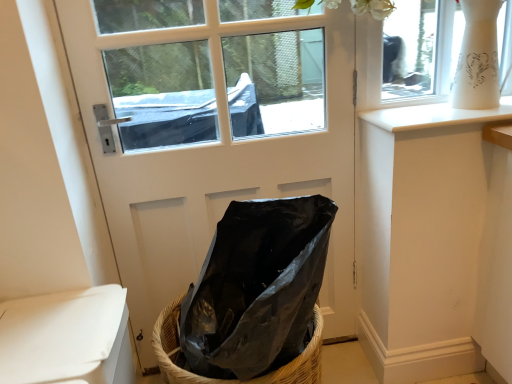
Question: From the image's perspective, is white glossy window sill at upper right beneath black plastic bag at center?

Choices:
 (A) yes
 (B) no

Answer: (B)

Question: Considering the relative positions of white glossy window sill at upper right and black plastic bag at center in the image provided, is white glossy window sill at upper right to the left of black plastic bag at center from the viewer's perspective?

Choices:
 (A) no
 (B) yes

Answer: (A)

Question: Can you confirm if white glossy window sill at upper right is smaller than black plastic bag at center?

Choices:
 (A) yes
 (B) no

Answer: (A)

Question: Can you confirm if white glossy window sill at upper right is positioned to the right of black plastic bag at center?

Choices:
 (A) yes
 (B) no

Answer: (A)

Question: Is white glossy window sill at upper right oriented away from black plastic bag at center?

Choices:
 (A) yes
 (B) no

Answer: (B)

Question: Is white matte toilet at lower left spatially inside woven straw basket at lower center, or outside of it?

Choices:
 (A) inside
 (B) outside

Answer: (B)

Question: Considering the positions of white matte toilet at lower left and woven straw basket at lower center in the image, is white matte toilet at lower left wider or thinner than woven straw basket at lower center?

Choices:
 (A) wide
 (B) thin

Answer: (B)

Question: From the image's perspective, is white matte toilet at lower left located above or below woven straw basket at lower center?

Choices:
 (A) below
 (B) above

Answer: (B)

Question: Does point (74, 372) appear closer or farther from the camera than point (313, 334)?

Choices:
 (A) farther
 (B) closer

Answer: (B)

Question: Is black plastic bag at center bigger or smaller than white matte door at center?

Choices:
 (A) small
 (B) big

Answer: (A)

Question: From the image's perspective, is black plastic bag at center located above or below white matte door at center?

Choices:
 (A) above
 (B) below

Answer: (B)

Question: Is black plastic bag at center taller or shorter than white matte door at center?

Choices:
 (A) short
 (B) tall

Answer: (A)

Question: Is point (285, 355) closer or farther from the camera than point (133, 39)?

Choices:
 (A) farther
 (B) closer

Answer: (B)

Question: Considering the positions of point (175, 327) and point (212, 251), is point (175, 327) closer or farther from the camera than point (212, 251)?

Choices:
 (A) farther
 (B) closer

Answer: (A)

Question: Is woven straw basket at lower center in front of or behind black plastic bag at center in the image?

Choices:
 (A) behind
 (B) front

Answer: (A)